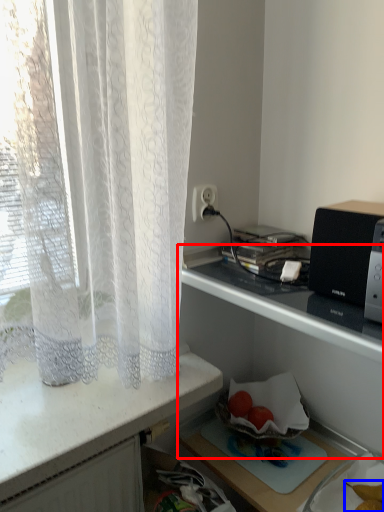
Question: Which point is closer to the camera, shelf (highlighted by a red box) or food (highlighted by a blue box)?

Choices:
 (A) shelf
 (B) food

Answer: (A)